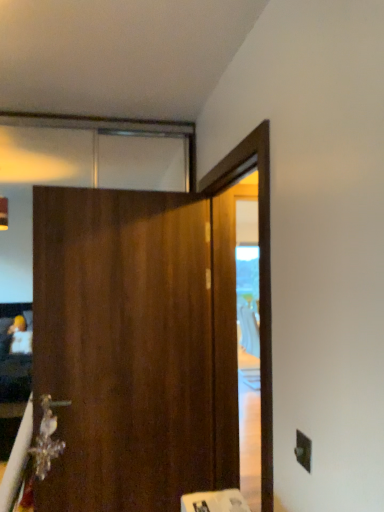
Question: From a real-world perspective, is black plastic electric outlet at lower right beneath metallic crystal at lower left?

Choices:
 (A) yes
 (B) no

Answer: (B)

Question: Does black plastic electric outlet at lower right have a larger size compared to metallic crystal at lower left?

Choices:
 (A) no
 (B) yes

Answer: (A)

Question: From the image's perspective, is black plastic electric outlet at lower right beneath metallic crystal at lower left?

Choices:
 (A) no
 (B) yes

Answer: (A)

Question: From a real-world perspective, is black plastic electric outlet at lower right located higher than metallic crystal at lower left?

Choices:
 (A) no
 (B) yes

Answer: (B)

Question: Is black plastic electric outlet at lower right facing towards metallic crystal at lower left?

Choices:
 (A) yes
 (B) no

Answer: (B)

Question: Is metallic crystal at lower left wider or thinner than wooden barn door at center?

Choices:
 (A) wide
 (B) thin

Answer: (B)

Question: From the image's perspective, is metallic crystal at lower left positioned above or below wooden barn door at center?

Choices:
 (A) below
 (B) above

Answer: (A)

Question: From a real-world perspective, is metallic crystal at lower left physically located above or below wooden barn door at center?

Choices:
 (A) above
 (B) below

Answer: (B)

Question: Does point (34, 440) appear closer or farther from the camera than point (125, 211)?

Choices:
 (A) farther
 (B) closer

Answer: (A)

Question: From the image's perspective, is metallic crystal at lower left above or below black plastic electric outlet at lower right?

Choices:
 (A) below
 (B) above

Answer: (A)

Question: Based on their sizes in the image, would you say metallic crystal at lower left is bigger or smaller than black plastic electric outlet at lower right?

Choices:
 (A) big
 (B) small

Answer: (A)

Question: Considering the positions of metallic crystal at lower left and black plastic electric outlet at lower right in the image, is metallic crystal at lower left taller or shorter than black plastic electric outlet at lower right?

Choices:
 (A) tall
 (B) short

Answer: (A)

Question: In terms of width, does metallic crystal at lower left look wider or thinner when compared to black plastic electric outlet at lower right?

Choices:
 (A) wide
 (B) thin

Answer: (A)

Question: In terms of height, does wooden barn door at center look taller or shorter compared to metallic crystal at lower left?

Choices:
 (A) tall
 (B) short

Answer: (A)

Question: Is wooden barn door at center inside or outside of metallic crystal at lower left?

Choices:
 (A) outside
 (B) inside

Answer: (A)